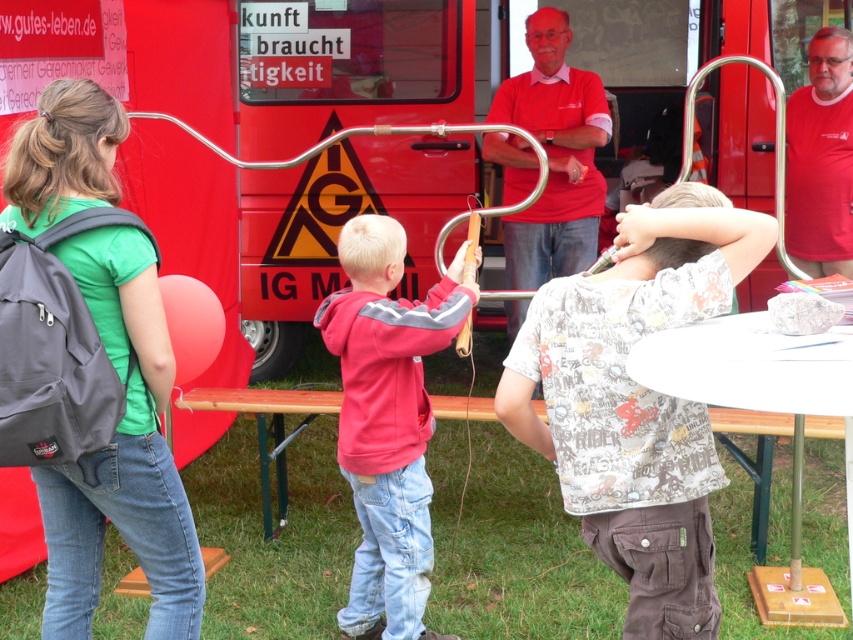
Which is more to the left, white printed t-shirt at center or matte red shirt at center?

From the viewer's perspective, white printed t-shirt at center appears more on the left side.

Between white printed t-shirt at center and matte red shirt at center, which one is positioned higher?

matte red shirt at center

Is point (503, 380) behind point (521, 250)?

That is False.

Locate an element on the screen. white printed t-shirt at center is located at coordinates click(636, 401).

Between point (648, 566) and point (633, 346), which one is positioned behind?

The point (648, 566) is behind.

Is point (734, 227) positioned behind point (735, 394)?

Yes, it is.

In order to click on white printed t-shirt at center in this screenshot , I will do `click(636, 401)`.

Find the location of `white printed t-shirt at center`. white printed t-shirt at center is located at coordinates (636, 401).

Is white plastic picnic table at lower center positioned in front of red cotton shirt at center?

Yes, it is.

Which is more to the left, white plastic picnic table at lower center or red cotton shirt at center?

white plastic picnic table at lower center is more to the left.

Between point (827, 385) and point (811, 266), which one is positioned in front?

Point (827, 385)

Identify the location of white plastic picnic table at lower center. This screenshot has height=640, width=853. (740, 372).